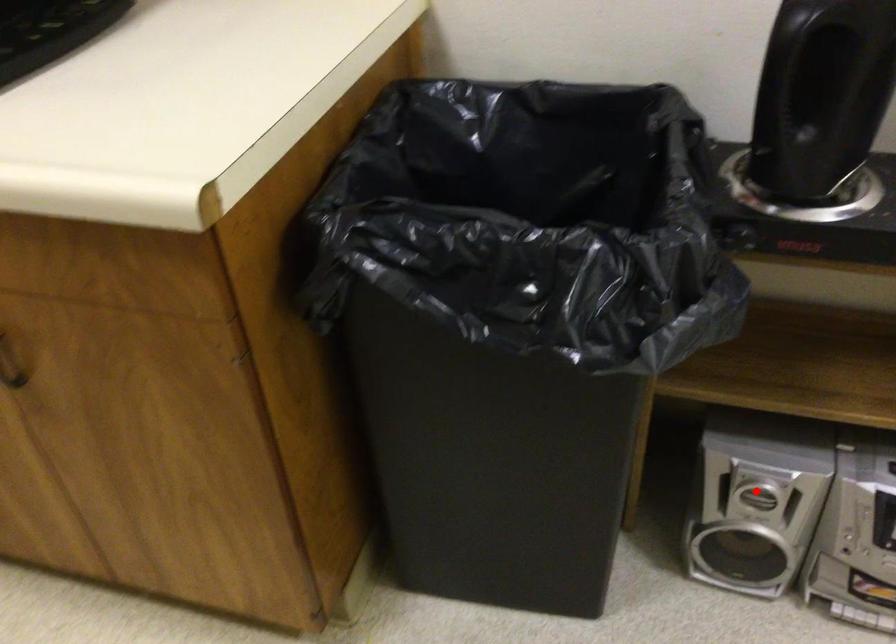
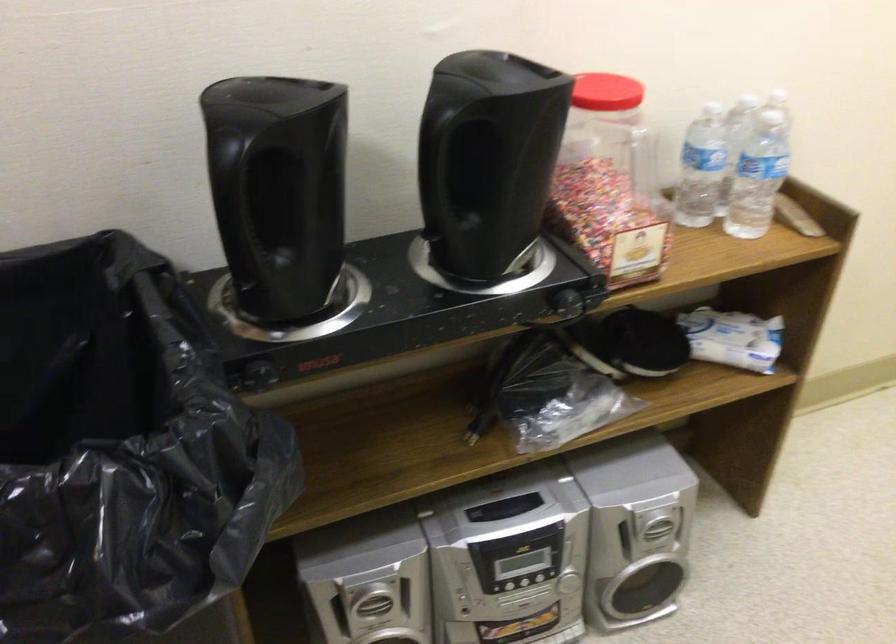
Locate, in the second image, the point that corresponds to the highlighted location in the first image.

(373, 603)